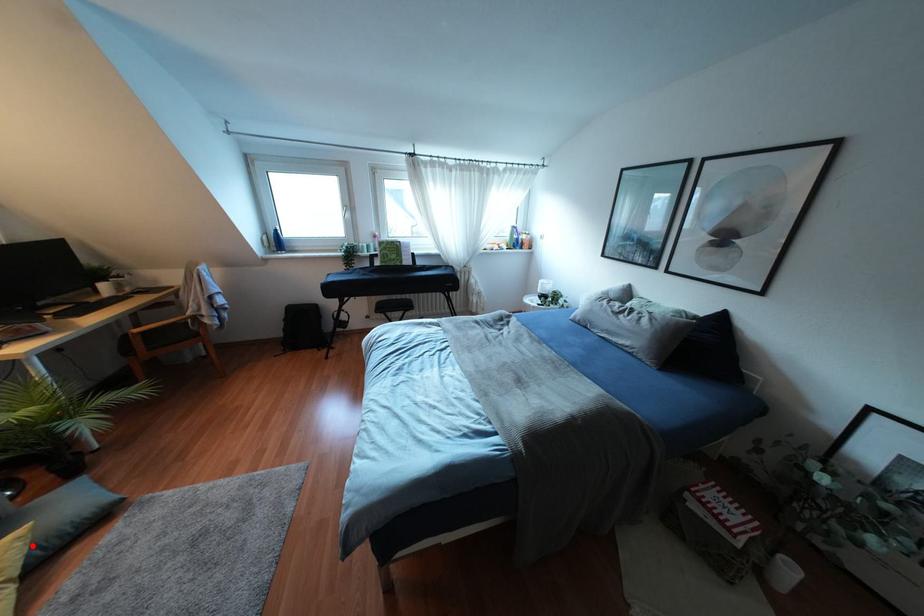
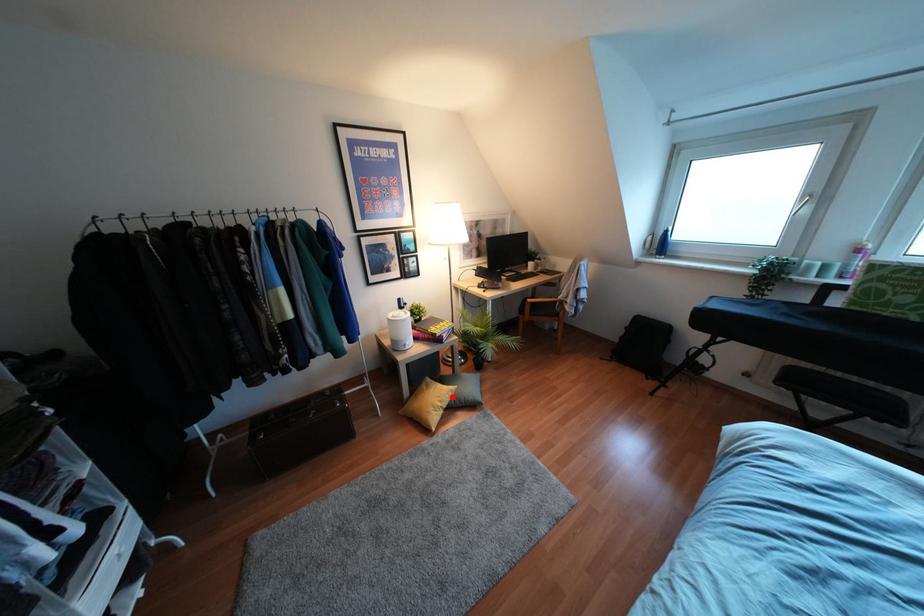
I am providing you with two images of the same scene from different viewpoints. A red point is marked on the first image and another point is marked on the second image. Do the highlighted points in image1 and image2 indicate the same real-world spot?

Yes